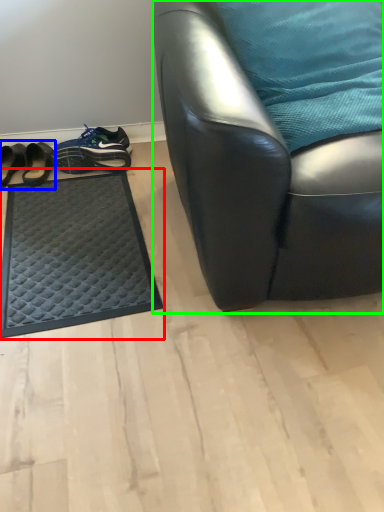
Question: Which object is positioned farthest from mat (highlighted by a red box)? Select from footwear (highlighted by a blue box) and chair (highlighted by a green box).

Choices:
 (A) footwear
 (B) chair

Answer: (B)